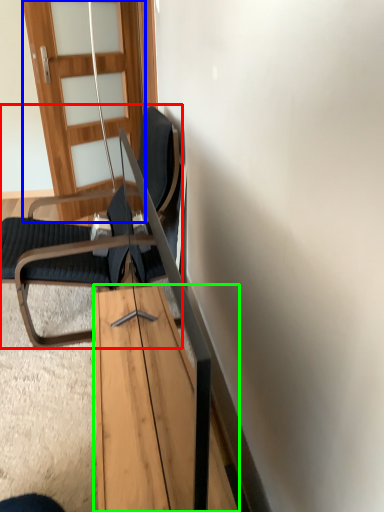
Question: Estimate the real-world distances between objects in this image. Which object is closer to chair (highlighted by a red box), door (highlighted by a blue box) or table (highlighted by a green box)?

Choices:
 (A) door
 (B) table

Answer: (B)